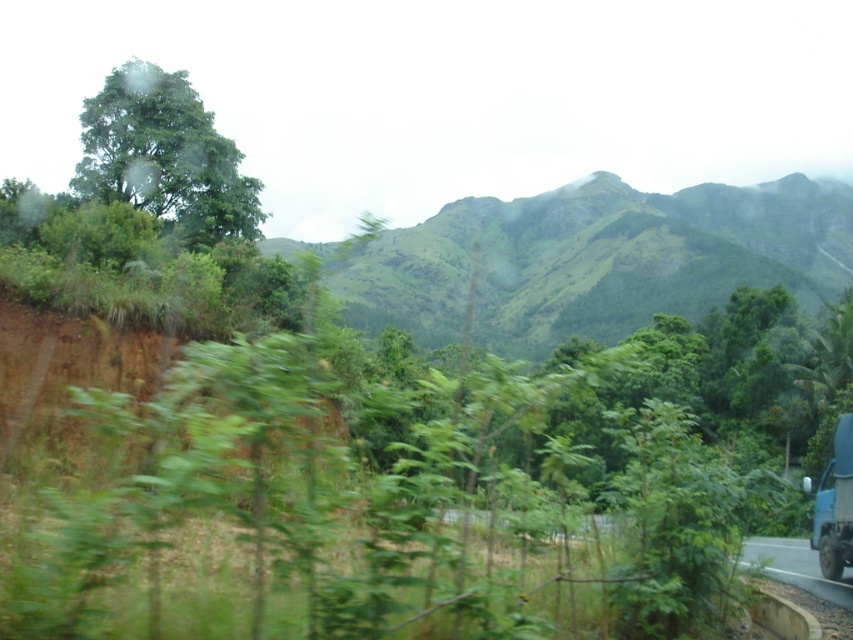
Question: Among these points, which one is farthest from the camera?

Choices:
 (A) (831, 572)
 (B) (190, 218)
 (C) (752, 225)
 (D) (825, 481)

Answer: (C)

Question: Which object is closer to the camera taking this photo?

Choices:
 (A) green leafy tree at upper left
 (B) transparent glass train window at lower right
 (C) green grassy mountain at center

Answer: (B)

Question: In this image, where is blue metallic trailer truck at lower right located relative to transparent glass train window at lower right?

Choices:
 (A) left
 (B) right

Answer: (A)

Question: Can you confirm if green grassy mountain at center is positioned above green leafy tree at upper left?

Choices:
 (A) no
 (B) yes

Answer: (B)

Question: Is green leafy tree at upper left above transparent glass train window at lower right?

Choices:
 (A) no
 (B) yes

Answer: (B)

Question: Which point is closer to the camera?

Choices:
 (A) transparent glass train window at lower right
 (B) green leafy tree at upper left

Answer: (A)